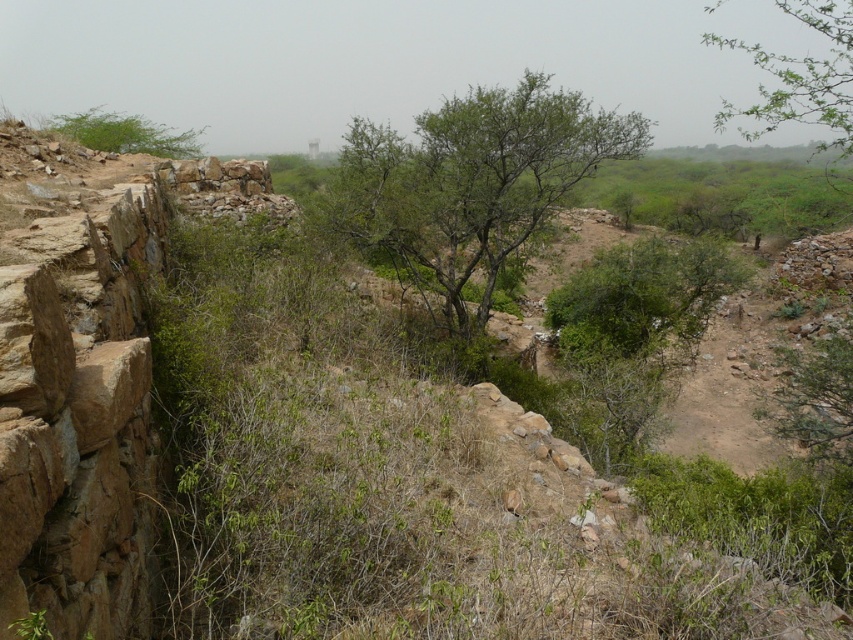
Does brown rough stone cliff at left lie behind green leafy tree at upper right?

No.

The width and height of the screenshot is (853, 640). What do you see at coordinates (88, 380) in the screenshot?
I see `brown rough stone cliff at left` at bounding box center [88, 380].

Locate an element on the screen. This screenshot has width=853, height=640. brown rough stone cliff at left is located at coordinates (x=88, y=380).

Is green leafy tree at center shorter than green leafy tree at upper right?

Yes.

Does point (486, 193) lie in front of point (827, 10)?

Yes, it is.

Where is `green leafy tree at center`? green leafy tree at center is located at coordinates (469, 184).

Who is higher up, green leafy tree at center or green leafy shrub at upper left?

green leafy shrub at upper left

Consider the image. Is green leafy tree at center smaller than green leafy shrub at upper left?

Yes, green leafy tree at center is smaller than green leafy shrub at upper left.

Describe the element at coordinates (469, 184) in the screenshot. I see `green leafy tree at center` at that location.

Find the location of a particular element. This screenshot has width=853, height=640. green leafy tree at center is located at coordinates (469, 184).